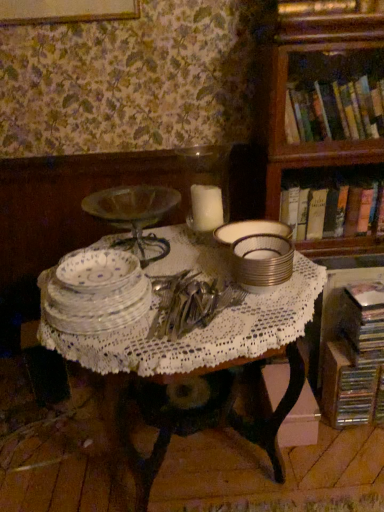
Question: Is hardcover books at upper right, acting as the first book starting from the top, wider than silver metallic stack at center, the second tableware viewed from the left?

Choices:
 (A) no
 (B) yes

Answer: (B)

Question: Can you confirm if hardcover books at upper right, acting as the first book starting from the top, is shorter than silver metallic stack at center, the second tableware viewed from the left?

Choices:
 (A) yes
 (B) no

Answer: (B)

Question: Is hardcover books at upper right, the 3th book from the bottom, positioned beyond the bounds of silver metallic stack at center, the second tableware viewed from the left?

Choices:
 (A) no
 (B) yes

Answer: (B)

Question: Is hardcover books at upper right, acting as the first book starting from the top, thinner than silver metallic stack at center, the second tableware viewed from the left?

Choices:
 (A) no
 (B) yes

Answer: (A)

Question: From a real-world perspective, is hardcover books at upper right, the 3th book from the bottom, located beneath silver metallic stack at center, positioned as the 1th tableware in right-to-left order?

Choices:
 (A) no
 (B) yes

Answer: (A)

Question: From a real-world perspective, is metallic silver book at lower right, which is the 3th book from top to bottom, positioned above or below clear glass plates at center, positioned as the first tableware in left-to-right order?

Choices:
 (A) below
 (B) above

Answer: (A)

Question: Is metallic silver book at lower right, acting as the first book starting from the bottom, in front of or behind clear glass plates at center, placed as the second tableware when sorted from right to left, in the image?

Choices:
 (A) front
 (B) behind

Answer: (B)

Question: Which is correct: metallic silver book at lower right, acting as the first book starting from the bottom, is inside clear glass plates at center, positioned as the first tableware in left-to-right order, or outside of it?

Choices:
 (A) inside
 (B) outside

Answer: (B)

Question: From the image's perspective, is metallic silver book at lower right, acting as the first book starting from the bottom, above or below clear glass plates at center, positioned as the first tableware in left-to-right order?

Choices:
 (A) above
 (B) below

Answer: (B)

Question: Is point (251, 245) positioned closer to the camera than point (311, 225)?

Choices:
 (A) closer
 (B) farther

Answer: (A)

Question: From a real-world perspective, is silver metallic stack at center, positioned as the 1th tableware in right-to-left order, above or below hardcover book at right, the 2th book positioned from the bottom?

Choices:
 (A) above
 (B) below

Answer: (A)

Question: Considering the positions of silver metallic stack at center, positioned as the 1th tableware in right-to-left order, and hardcover book at right, the 2th book positioned from the bottom, in the image, is silver metallic stack at center, positioned as the 1th tableware in right-to-left order, bigger or smaller than hardcover book at right, the 2th book positioned from the bottom,?

Choices:
 (A) big
 (B) small

Answer: (B)

Question: Is silver metallic stack at center, the second tableware viewed from the left, taller or shorter than hardcover book at right, the 2th book from the top?

Choices:
 (A) short
 (B) tall

Answer: (A)

Question: Is white wax candle at center wider or thinner than wooden bookcase at upper right?

Choices:
 (A) wide
 (B) thin

Answer: (B)

Question: Is white wax candle at center taller or shorter than wooden bookcase at upper right?

Choices:
 (A) short
 (B) tall

Answer: (A)